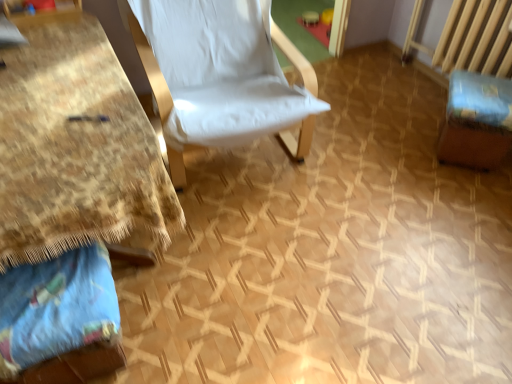
Question: Is brown fabric swivel chair at right bigger or smaller than white fabric chair at center?

Choices:
 (A) big
 (B) small

Answer: (B)

Question: Considering the positions of point (487, 114) and point (282, 112), is point (487, 114) closer or farther from the camera than point (282, 112)?

Choices:
 (A) farther
 (B) closer

Answer: (A)

Question: Which object is the closest to the blue cotton pillow at lower left?

Choices:
 (A) white fabric chair at center
 (B) wooden table at left
 (C) brown fabric swivel chair at right

Answer: (B)

Question: Which of these objects is positioned closest to the brown fabric swivel chair at right?

Choices:
 (A) blue cotton pillow at lower left
 (B) white fabric chair at center
 (C) wooden table at left

Answer: (B)